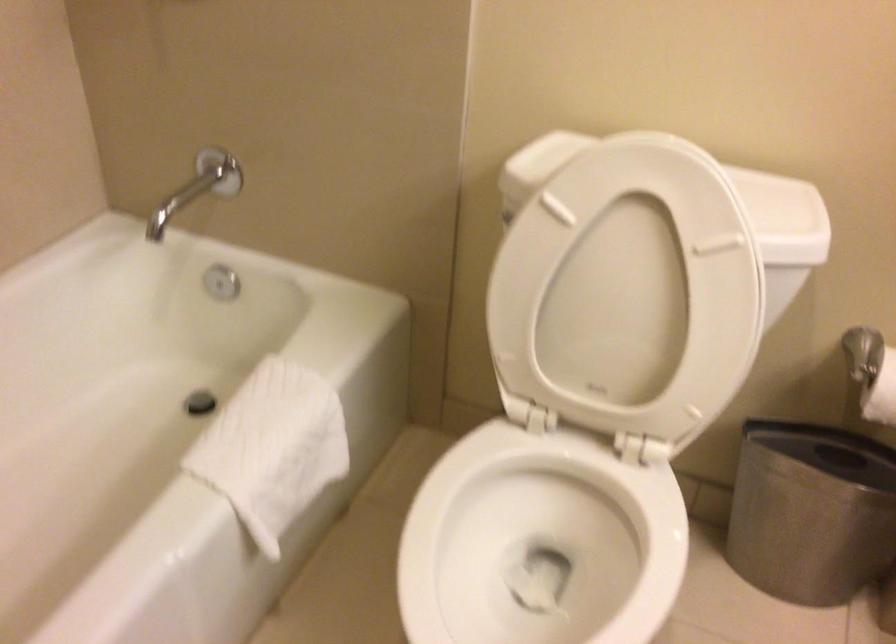
Where would you tear the toilet paper roll? Please return your answer as a coordinate pair (x, y).

(881, 393)